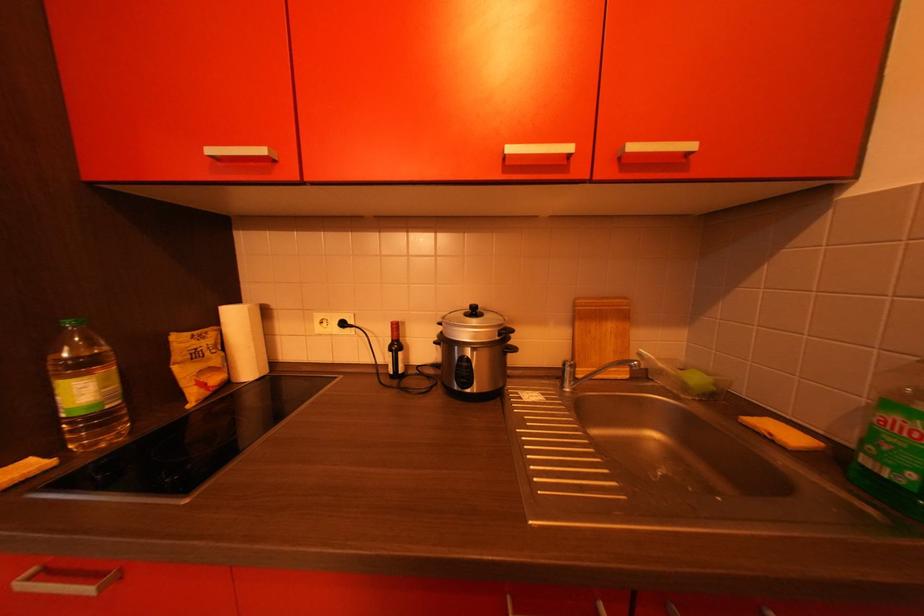
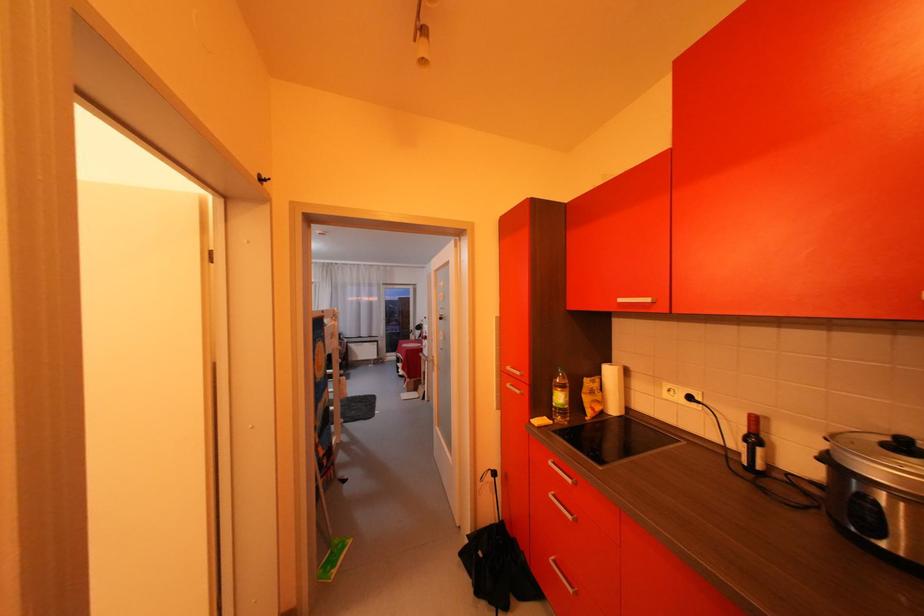
Where in the second image is the point corresponding to [335,326] from the first image?

(684, 394)